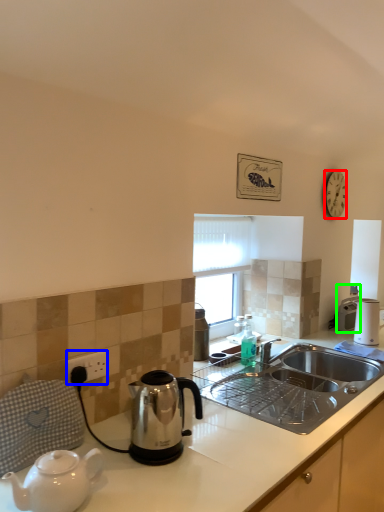
Question: Which is nearer to the clock (highlighted by a red box)? power outlet (highlighted by a blue box) or coffee maker (highlighted by a green box).

Choices:
 (A) power outlet
 (B) coffee maker

Answer: (B)